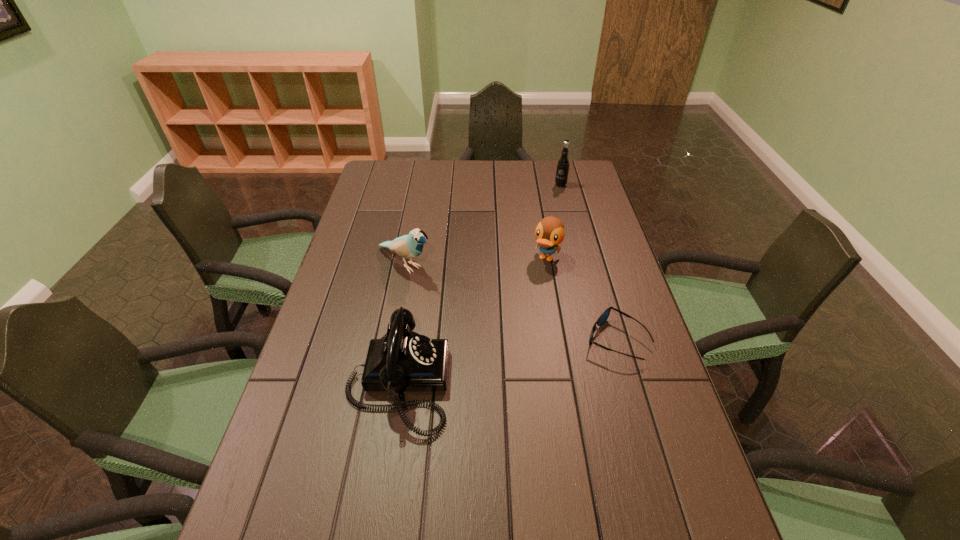
At what (x,y) coordinates should I click in order to perform the action: click on bird that is positioned at the left edge. Please return your answer as a coordinate pair (x, y). Image resolution: width=960 pixels, height=540 pixels. Looking at the image, I should click on (409, 246).

Locate an element on the screen. sunglasses that is at the right edge is located at coordinates (603, 317).

Identify the location of root beer present at the right edge. point(563,163).

The width and height of the screenshot is (960, 540). Find the location of `object that is at the far right corner`. object that is at the far right corner is located at coordinates (563, 163).

This screenshot has height=540, width=960. In the image, there is a desktop. Identify the location of free space at the far edge. (512, 171).

In the image, there is a desktop. Where is `free space at the near edge`? The width and height of the screenshot is (960, 540). free space at the near edge is located at coordinates (444, 498).

I want to click on vacant position at the left edge of the desktop, so click(x=342, y=249).

Where is `free region at the right edge of the desktop`? The height and width of the screenshot is (540, 960). free region at the right edge of the desktop is located at coordinates (562, 197).

In the image, there is a desktop. In order to click on vacant space at the near left corner in this screenshot , I will do `click(274, 522)`.

In the image, there is a desktop. Where is `vacant space at the far right corner`? This screenshot has height=540, width=960. vacant space at the far right corner is located at coordinates (586, 185).